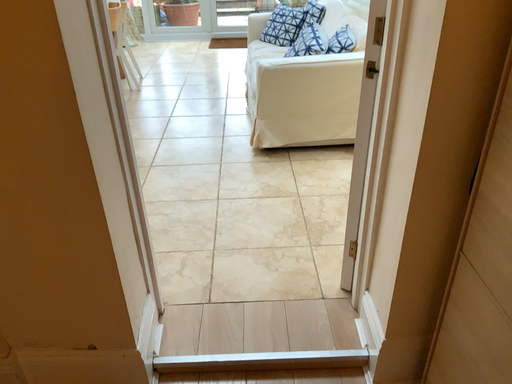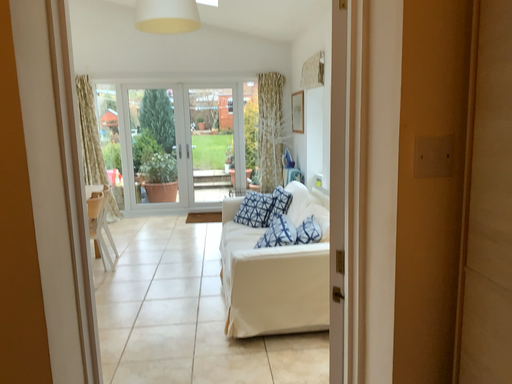
Question: How did the camera likely rotate when shooting the video?

Choices:
 (A) rotated downward
 (B) rotated upward

Answer: (B)